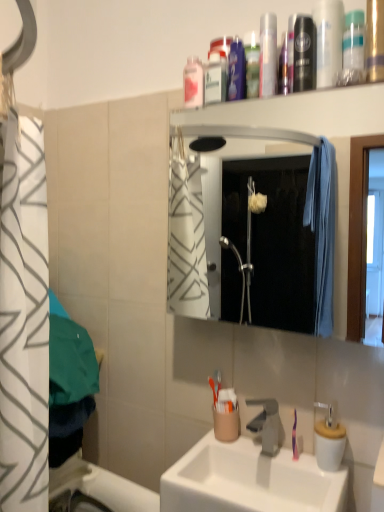
Identify the location of vacant region to the left of pink plastic toothbrush at lower right. (251, 450).